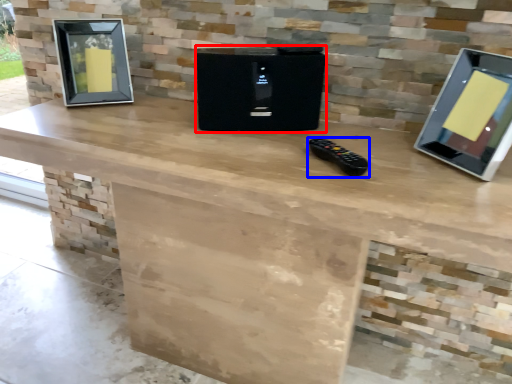
Question: Which object appears closest to the camera in this image, appliance (highlighted by a red box) or game controller (highlighted by a blue box)?

Choices:
 (A) appliance
 (B) game controller

Answer: (B)